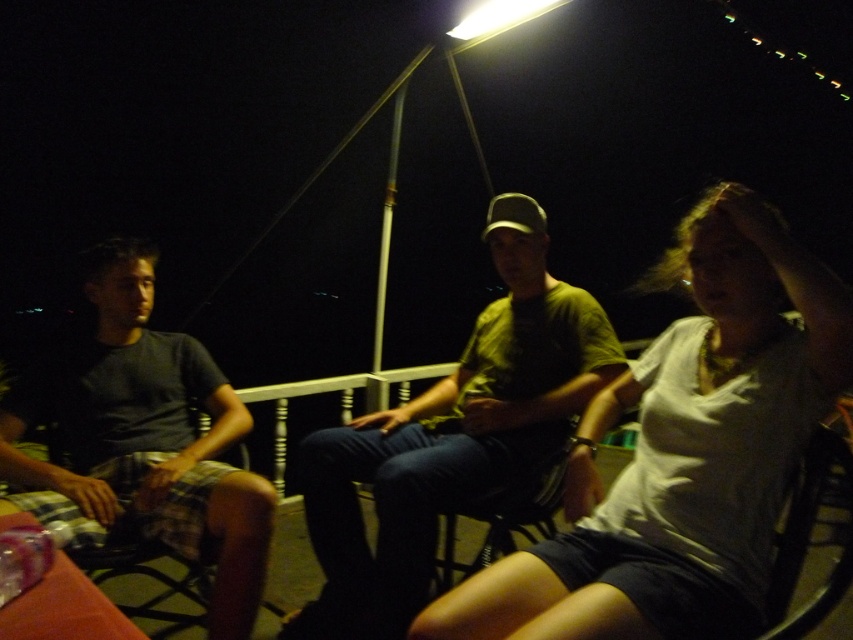
The height and width of the screenshot is (640, 853). I want to click on green matte shirt at center, so click(451, 436).

Which is above, green matte shirt at center or dark gray t-shirt at left?

Positioned higher is green matte shirt at center.

Does point (310, 531) come closer to viewer compared to point (245, 637)?

That is False.

The width and height of the screenshot is (853, 640). In order to click on green matte shirt at center in this screenshot , I will do [451, 436].

Does white cotton shirt at center appear over green matte shirt at center?

Yes, white cotton shirt at center is above green matte shirt at center.

Identify the location of white cotton shirt at center. (682, 452).

Which is more to the left, white cotton shirt at center or dark gray t-shirt at left?

dark gray t-shirt at left is more to the left.

Is white cotton shirt at center taller than dark gray t-shirt at left?

Incorrect, white cotton shirt at center's height is not larger of dark gray t-shirt at left's.

The width and height of the screenshot is (853, 640). What do you see at coordinates (682, 452) in the screenshot? I see `white cotton shirt at center` at bounding box center [682, 452].

What are the coordinates of `white cotton shirt at center` in the screenshot? It's located at 682,452.